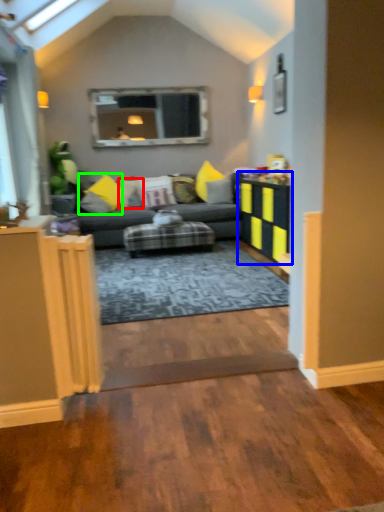
Question: Which object is the closest to the pillow (highlighted by a red box)? Choose among these: table (highlighted by a blue box) or pillow (highlighted by a green box).

Choices:
 (A) table
 (B) pillow

Answer: (B)